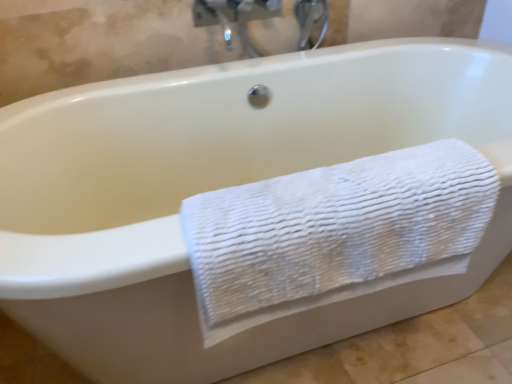
The height and width of the screenshot is (384, 512). What do you see at coordinates (335, 233) in the screenshot?
I see `white textured towel at lower right` at bounding box center [335, 233].

The height and width of the screenshot is (384, 512). Find the location of `white textured towel at lower right`. white textured towel at lower right is located at coordinates (335, 233).

The image size is (512, 384). What are the coordinates of `matte silver faucet at upper center` in the screenshot? It's located at (311, 21).

Measure the distance between point (305, 26) and camera.

They are 4.97 feet apart.

The height and width of the screenshot is (384, 512). What do you see at coordinates (311, 21) in the screenshot?
I see `matte silver faucet at upper center` at bounding box center [311, 21].

Where is `white textured towel at lower right`? Image resolution: width=512 pixels, height=384 pixels. white textured towel at lower right is located at coordinates (335, 233).

Is matte silver faucet at upper center to the left of white textured towel at lower right from the viewer's perspective?

In fact, matte silver faucet at upper center is to the right of white textured towel at lower right.

Based on the photo, considering the positions of objects matte silver faucet at upper center and white textured towel at lower right in the image provided, who is in front, matte silver faucet at upper center or white textured towel at lower right?

white textured towel at lower right is closer to the camera.

Is point (298, 1) more distant than point (276, 307)?

Yes, point (298, 1) is farther from viewer.

From the image's perspective, is matte silver faucet at upper center positioned above or below white textured towel at lower right?

Clearly, from the image's perspective, matte silver faucet at upper center is above white textured towel at lower right.

Looking at this image, from a real-world perspective, who is located lower, matte silver faucet at upper center or white textured towel at lower right?

white textured towel at lower right, from a real-world perspective.

Does matte silver faucet at upper center have a greater width compared to white textured towel at lower right?

Incorrect, the width of matte silver faucet at upper center does not surpass that of white textured towel at lower right.

Is matte silver faucet at upper center taller than white textured towel at lower right?

No.

Between matte silver faucet at upper center and white textured towel at lower right, which one has larger size?

Bigger between the two is white textured towel at lower right.

Is matte silver faucet at upper center inside the boundaries of white textured towel at lower right, or outside?

matte silver faucet at upper center is located beyond the bounds of white textured towel at lower right.

Are matte silver faucet at upper center and white textured towel at lower right located far from each other?

No, there isn't a large distance between matte silver faucet at upper center and white textured towel at lower right.

Is matte silver faucet at upper center aimed at white textured towel at lower right?

No, matte silver faucet at upper center is not facing towards white textured towel at lower right.

Where is `towel that is below the matte silver faucet at upper center (from the image's perspective)`? Image resolution: width=512 pixels, height=384 pixels. towel that is below the matte silver faucet at upper center (from the image's perspective) is located at coordinates (335, 233).

Can you confirm if white textured towel at lower right is positioned to the left of matte silver faucet at upper center?

Yes, white textured towel at lower right is to the left of matte silver faucet at upper center.

Which object is further away from the camera, white textured towel at lower right or matte silver faucet at upper center?

matte silver faucet at upper center.

Is point (343, 270) closer or farther from the camera than point (300, 31)?

Point (343, 270) appears to be closer to the viewer than point (300, 31).

From the image's perspective, is white textured towel at lower right above or below matte silver faucet at upper center?

white textured towel at lower right is situated lower than matte silver faucet at upper center in the image.

From a real-world perspective, is white textured towel at lower right positioned above or below matte silver faucet at upper center?

In terms of real-world spatial position, white textured towel at lower right is below matte silver faucet at upper center.

Considering the relative sizes of white textured towel at lower right and matte silver faucet at upper center in the image provided, is white textured towel at lower right thinner than matte silver faucet at upper center?

Incorrect, the width of white textured towel at lower right is not less than that of matte silver faucet at upper center.

Considering the relative sizes of white textured towel at lower right and matte silver faucet at upper center in the image provided, is white textured towel at lower right taller than matte silver faucet at upper center?

Indeed, white textured towel at lower right has a greater height compared to matte silver faucet at upper center.

Is white textured towel at lower right bigger than matte silver faucet at upper center?

Correct, white textured towel at lower right is larger in size than matte silver faucet at upper center.

Does white textured towel at lower right contain matte silver faucet at upper center?

No, matte silver faucet at upper center is not inside white textured towel at lower right.

Consider the image. Is white textured towel at lower right far from matte silver faucet at upper center?

Actually, white textured towel at lower right and matte silver faucet at upper center are a little close together.

Consider the image. Is matte silver faucet at upper center at the back of white textured towel at lower right?

Yes, matte silver faucet at upper center is at the back of white textured towel at lower right.

Where is `faucet that is above the white textured towel at lower right (from the image's perspective)`? This screenshot has height=384, width=512. faucet that is above the white textured towel at lower right (from the image's perspective) is located at coordinates (311, 21).

Identify the location of faucet on the right of white textured towel at lower right. Image resolution: width=512 pixels, height=384 pixels. (311, 21).

Identify the location of towel lying below the matte silver faucet at upper center (from the image's perspective). (335, 233).